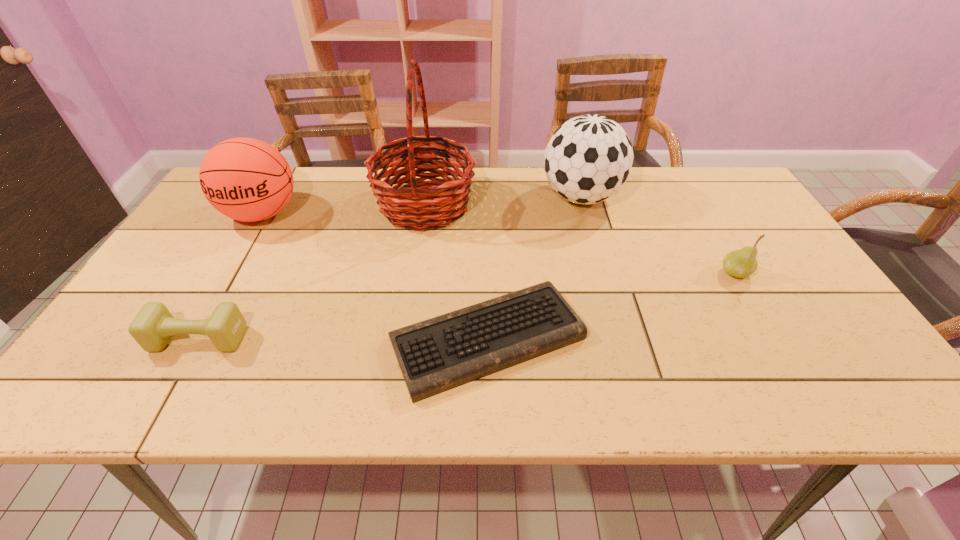
The height and width of the screenshot is (540, 960). I want to click on vacant space located on the left of the rightmost object, so click(x=562, y=273).

Where is `vacant region located on the right of the second shortest object`? The width and height of the screenshot is (960, 540). vacant region located on the right of the second shortest object is located at coordinates (311, 339).

What are the coordinates of `vacant region located on the back of the computer keyboard` in the screenshot? It's located at (486, 214).

Identify the location of basket that is at the far edge. (409, 207).

Image resolution: width=960 pixels, height=540 pixels. I want to click on soccer ball that is positioned at the far edge, so click(x=588, y=159).

I want to click on basketball that is at the far edge, so click(246, 179).

Identify the location of object that is positioned at the near edge. The image size is (960, 540). (435, 355).

Identify the location of basketball that is at the left edge. (246, 179).

Where is `dumbbell that is at the left edge`? dumbbell that is at the left edge is located at coordinates (152, 328).

I want to click on object that is at the right edge, so click(x=741, y=263).